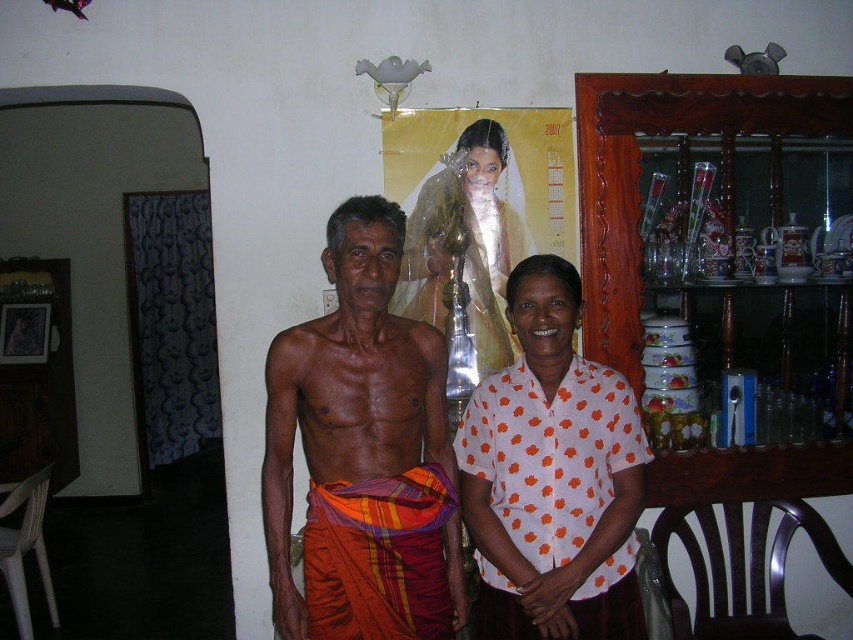
You are a photographer who needs to adjust the lighting to ensure both the white dotted shirt at center and the white satin dress at center are visible. Since one is closer to the camera, which one requires less adjustment to avoid overexposure?

The white dotted shirt at center is closer to the viewer, so it requires less adjustment to avoid overexposure because it is nearer to the camera and thus receives more direct light.

You are a photographer setting up a shoot in the described scene. You need to ensure that the white dotted shirt at center and the white satin dress at center are both visible in the frame. Given their widths, which clothing item requires a wider space to accommodate its width?

The white dotted shirt at center requires a wider space because its width surpasses that of the white satin dress at center.

You are a photographer arranging a photo shoot. You have an orange woven cloth at center and a white dotted shirt at center. If you want to place both items side by side on a table, which item should you place first to ensure they fit properly?

The orange woven cloth at center is wider than the white dotted shirt at center, so you should place the orange woven cloth at center first to accommodate its larger width.